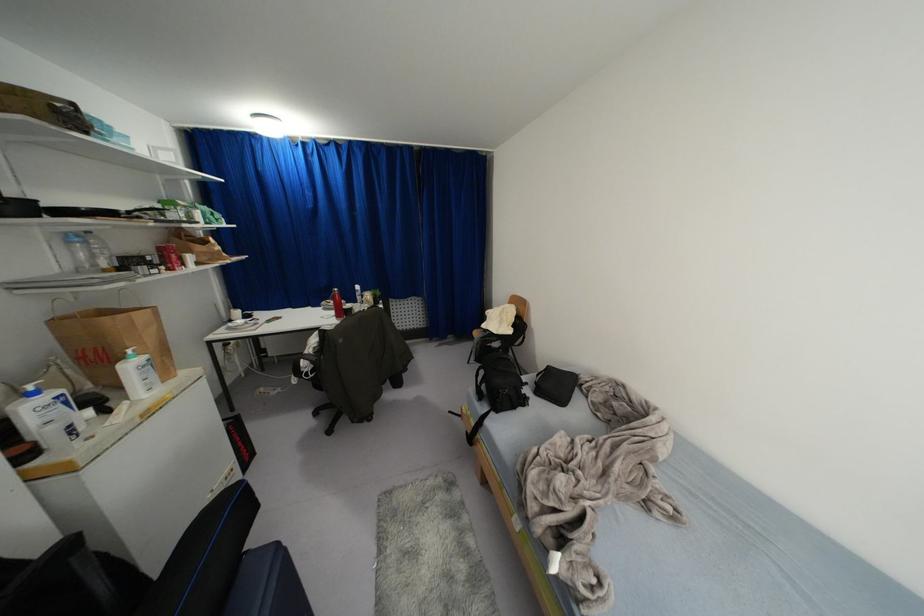
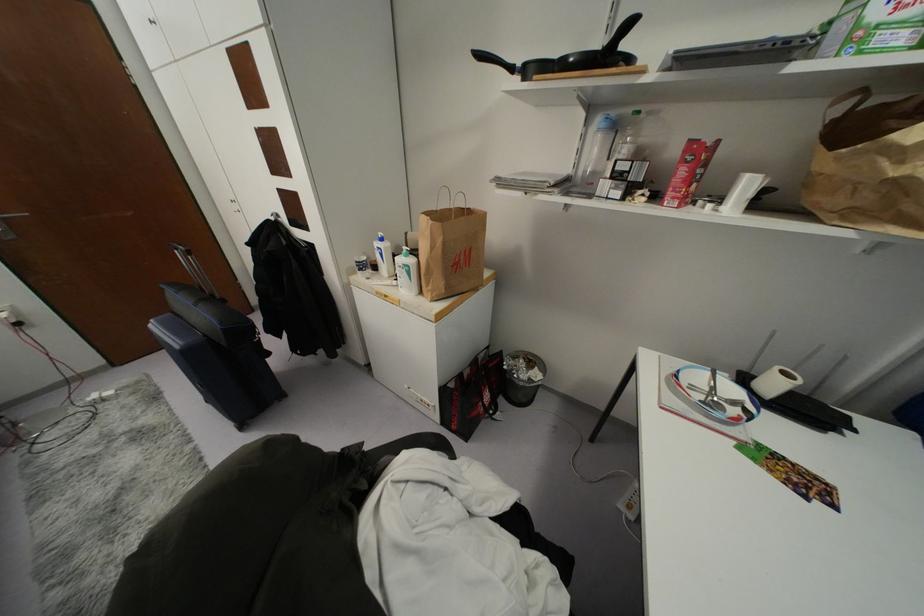
Find the pixel in the second image that matches (x=68, y=241) in the first image.

(599, 130)